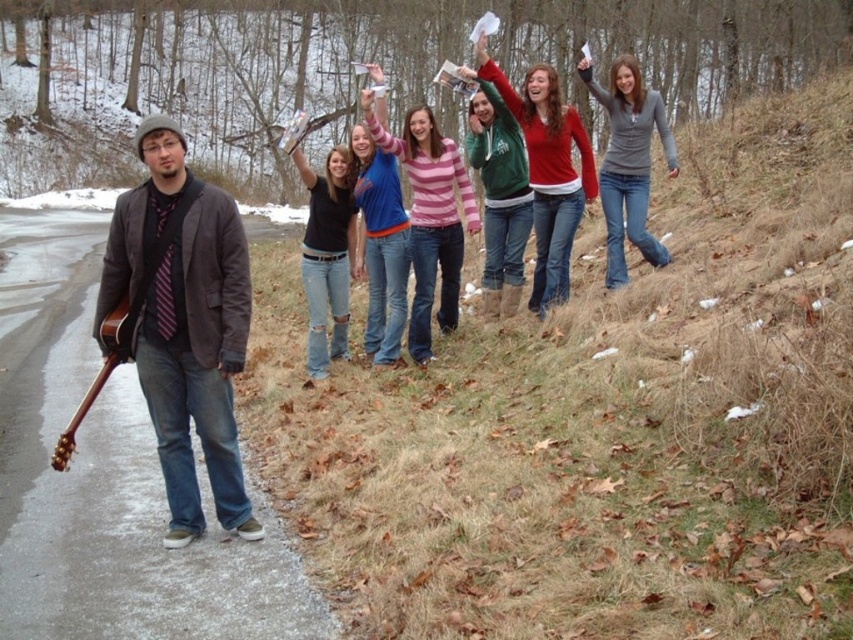
You are organizing a clothing display and need to arrange the pink striped sweater at center and the matte blue jeans at center on a rack. Based on their sizes, which item should you place first to maximize space efficiency?

The pink striped sweater at center occupies less space than matte blue jeans at center, so you should place the pink striped sweater at center first to maximize space efficiency by utilizing smaller spaces first.

You are a photographer wanting to capture both the matte black jacket at left and the pink striped sweater at center in a single frame. Which object should you focus on first to ensure both are in the frame?

The matte black jacket at left is much taller than the pink striped sweater at center, so focus on the matte black jacket at left first to ensure both are in the frame.